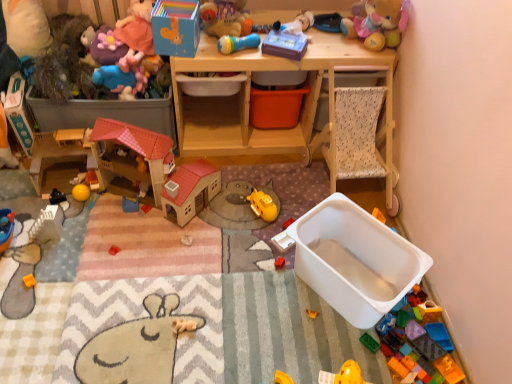
What are the coordinates of `vacant region to the right of blue plastic toy at center, the 5th toy viewed from the left` in the screenshot? It's located at (163, 221).